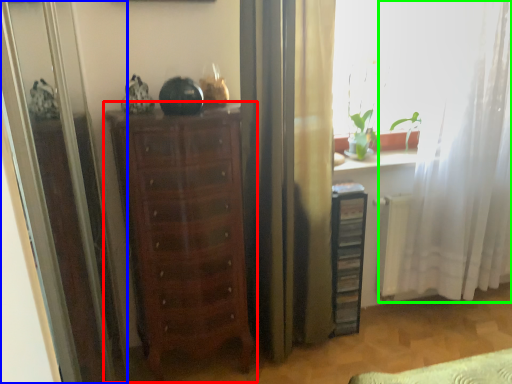
Question: Considering the real-world distances, which object is closest to chest of drawers (highlighted by a red box)? screen door (highlighted by a blue box) or curtain (highlighted by a green box).

Choices:
 (A) screen door
 (B) curtain

Answer: (A)